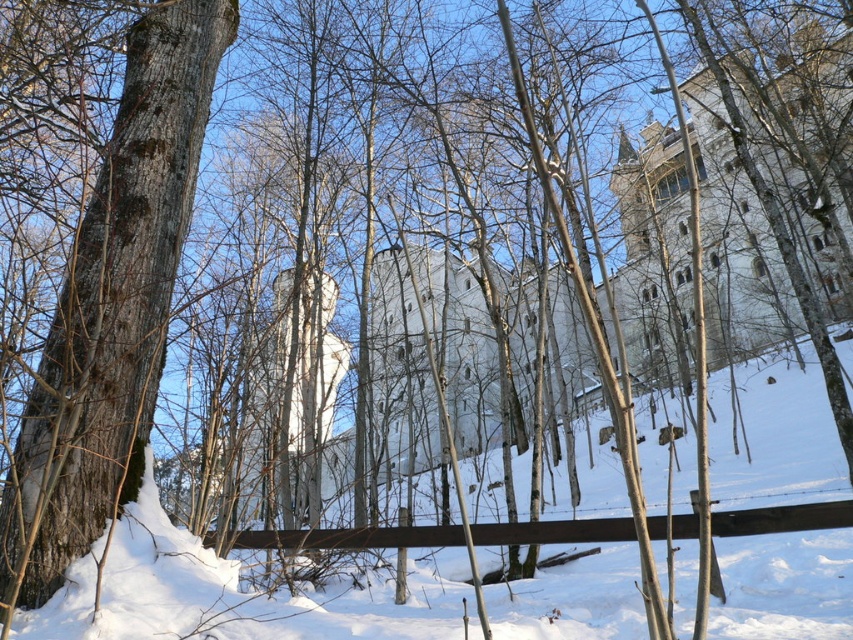
Can you confirm if white powdery snow at center is positioned below smooth bark tree at left?

Correct, white powdery snow at center is located below smooth bark tree at left.

Which is behind, point (776, 570) or point (123, 426)?

Point (776, 570)

The height and width of the screenshot is (640, 853). Find the location of `white powdery snow at center`. white powdery snow at center is located at coordinates (233, 593).